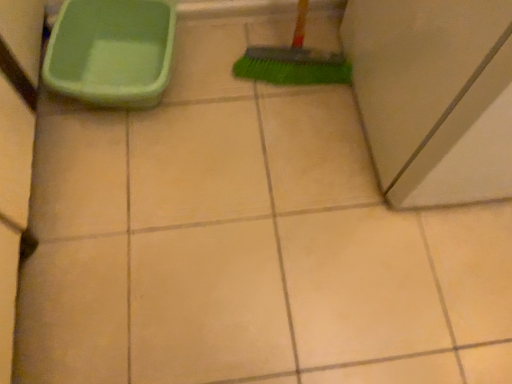
Identify the location of green plastic bucket at upper left. This screenshot has height=384, width=512. (111, 51).

What do you see at coordinates (111, 51) in the screenshot?
I see `green plastic bucket at upper left` at bounding box center [111, 51].

At what (x,y) coordinates should I click in order to perform the action: click on matte gray cabinet at right. Please return your answer as a coordinate pair (x, y). The height and width of the screenshot is (384, 512). Looking at the image, I should click on (434, 96).

Describe the element at coordinates (434, 96) in the screenshot. I see `matte gray cabinet at right` at that location.

Image resolution: width=512 pixels, height=384 pixels. In order to click on green plastic bucket at upper left in this screenshot , I will do `click(111, 51)`.

Does matte gray cabinet at right appear on the right side of green plastic bucket at upper left?

Indeed, matte gray cabinet at right is positioned on the right side of green plastic bucket at upper left.

Who is more distant, matte gray cabinet at right or green plastic bucket at upper left?

green plastic bucket at upper left.

Considering the positions of point (402, 37) and point (162, 82), is point (402, 37) closer or farther from the camera than point (162, 82)?

Point (402, 37) is closer to the camera than point (162, 82).

From the image's perspective, is matte gray cabinet at right positioned above or below green plastic bucket at upper left?

matte gray cabinet at right is above green plastic bucket at upper left.

From a real-world perspective, does matte gray cabinet at right sit lower than green plastic bucket at upper left?

No, from a real-world perspective, matte gray cabinet at right is not beneath green plastic bucket at upper left.

In terms of width, does matte gray cabinet at right look wider or thinner when compared to green plastic bucket at upper left?

Clearly, matte gray cabinet at right has more width compared to green plastic bucket at upper left.

Considering the relative sizes of matte gray cabinet at right and green plastic bucket at upper left in the image provided, is matte gray cabinet at right shorter than green plastic bucket at upper left?

Incorrect, the height of matte gray cabinet at right does not fall short of that of green plastic bucket at upper left.

Can you confirm if matte gray cabinet at right is smaller than green plastic bucket at upper left?

No.

Is matte gray cabinet at right completely or partially outside of green plastic bucket at upper left?

Indeed, matte gray cabinet at right is completely outside green plastic bucket at upper left.

Is matte gray cabinet at right positioned far away from green plastic bucket at upper left?

No, matte gray cabinet at right is not far from green plastic bucket at upper left.

Does matte gray cabinet at right turn towards green plastic bucket at upper left?

No, matte gray cabinet at right is not turned towards green plastic bucket at upper left.

The width and height of the screenshot is (512, 384). In order to click on toilet below the matte gray cabinet at right (from a real-world perspective) in this screenshot , I will do `click(111, 51)`.

Is green plastic bucket at upper left at the right side of matte gray cabinet at right?

No.

Which is in front, green plastic bucket at upper left or matte gray cabinet at right?

Positioned in front is matte gray cabinet at right.

Does point (160, 81) appear closer or farther from the camera than point (424, 119)?

Point (160, 81).

From the image's perspective, between green plastic bucket at upper left and matte gray cabinet at right, who is located below?

green plastic bucket at upper left appears lower in the image.

From a real-world perspective, which object stands above the other?

In real-world perspective, matte gray cabinet at right is above.

Considering the relative sizes of green plastic bucket at upper left and matte gray cabinet at right in the image provided, is green plastic bucket at upper left thinner than matte gray cabinet at right?

Yes, green plastic bucket at upper left is thinner than matte gray cabinet at right.

Who is shorter, green plastic bucket at upper left or matte gray cabinet at right?

With less height is green plastic bucket at upper left.

Does green plastic bucket at upper left have a smaller size compared to matte gray cabinet at right?

Yes, green plastic bucket at upper left is smaller than matte gray cabinet at right.

Is green plastic bucket at upper left outside of matte gray cabinet at right?

green plastic bucket at upper left is positioned outside matte gray cabinet at right.

In the scene shown: Is green plastic bucket at upper left in contact with matte gray cabinet at right?

No, green plastic bucket at upper left is not making contact with matte gray cabinet at right.

Is green plastic bucket at upper left aimed at matte gray cabinet at right?

No, green plastic bucket at upper left is not oriented towards matte gray cabinet at right.

How many degrees apart are the facing directions of green plastic bucket at upper left and matte gray cabinet at right?

The angular difference between green plastic bucket at upper left and matte gray cabinet at right is 7.13 degrees.

How distant is green plastic bucket at upper left from matte gray cabinet at right?

green plastic bucket at upper left is 24.01 inches from matte gray cabinet at right.

You are a GUI agent. You are given a task and a screenshot of the screen. Output one action in this format:
    pyautogui.click(x=<x>, y=<y>)
    Task: Click on the toilet behind the matte gray cabinet at right
    This screenshot has height=384, width=512.
    Given the screenshot: What is the action you would take?
    pyautogui.click(x=111, y=51)

This screenshot has width=512, height=384. Find the location of `screen door in front of the green plastic bucket at upper left`. screen door in front of the green plastic bucket at upper left is located at coordinates (434, 96).

You are a GUI agent. You are given a task and a screenshot of the screen. Output one action in this format:
    pyautogui.click(x=<x>, y=<y>)
    Task: Click on the toilet that is behind the matte gray cabinet at right
    The width and height of the screenshot is (512, 384).
    Given the screenshot: What is the action you would take?
    pyautogui.click(x=111, y=51)